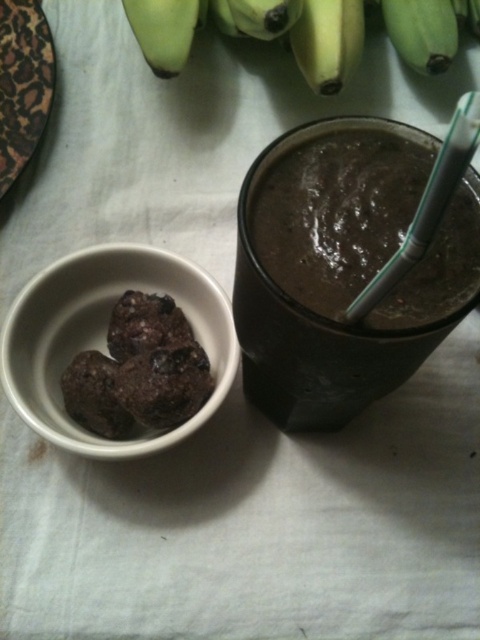
Looking at this image, does smooth dark chocolate pudding at center appear on the right side of white matte bowl at lower left?

Correct, you'll find smooth dark chocolate pudding at center to the right of white matte bowl at lower left.

Does smooth dark chocolate pudding at center have a greater width compared to white matte bowl at lower left?

In fact, smooth dark chocolate pudding at center might be narrower than white matte bowl at lower left.

The height and width of the screenshot is (640, 480). Find the location of `smooth dark chocolate pudding at center`. smooth dark chocolate pudding at center is located at coordinates (317, 323).

Is green matte bananas at upper center taller than green matte banana at upper left?

Indeed, green matte bananas at upper center has a greater height compared to green matte banana at upper left.

Is point (299, 26) less distant than point (173, 17)?

That is False.

Locate an element on the screen. green matte bananas at upper center is located at coordinates (302, 33).

How much distance is there between smooth dark chocolate pudding at center and green matte bananas at upper center?

smooth dark chocolate pudding at center is 56.65 centimeters from green matte bananas at upper center.

Is smooth dark chocolate pudding at center to the left of green matte bananas at upper center from the viewer's perspective?

Indeed, smooth dark chocolate pudding at center is positioned on the left side of green matte bananas at upper center.

Describe the element at coordinates (317, 323) in the screenshot. I see `smooth dark chocolate pudding at center` at that location.

Where is `smooth dark chocolate pudding at center`? smooth dark chocolate pudding at center is located at coordinates (317, 323).